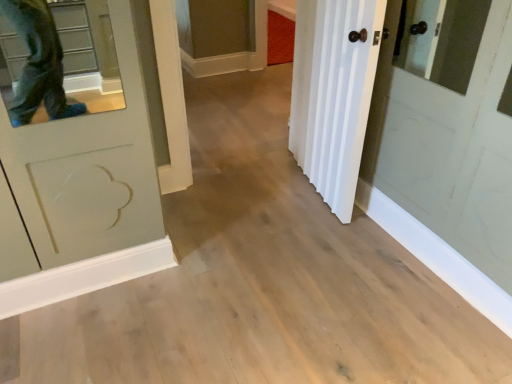
Question: From a real-world perspective, is white matte cabinet at upper center physically located above or below white wood door at center?

Choices:
 (A) below
 (B) above

Answer: (A)

Question: In terms of size, does white matte cabinet at upper center appear bigger or smaller than white wood door at center?

Choices:
 (A) big
 (B) small

Answer: (A)

Question: From the image's perspective, relative to white wood door at center, is white matte cabinet at upper center above or below?

Choices:
 (A) below
 (B) above

Answer: (B)

Question: Is white wood door at center taller or shorter than white matte cabinet at upper center?

Choices:
 (A) tall
 (B) short

Answer: (A)

Question: Looking at their shapes, would you say white wood door at center is wider or thinner than white matte cabinet at upper center?

Choices:
 (A) wide
 (B) thin

Answer: (B)

Question: Visually, is white wood door at center positioned to the left or to the right of white matte cabinet at upper center?

Choices:
 (A) left
 (B) right

Answer: (B)

Question: Does point (372, 23) appear closer or farther from the camera than point (192, 29)?

Choices:
 (A) closer
 (B) farther

Answer: (A)